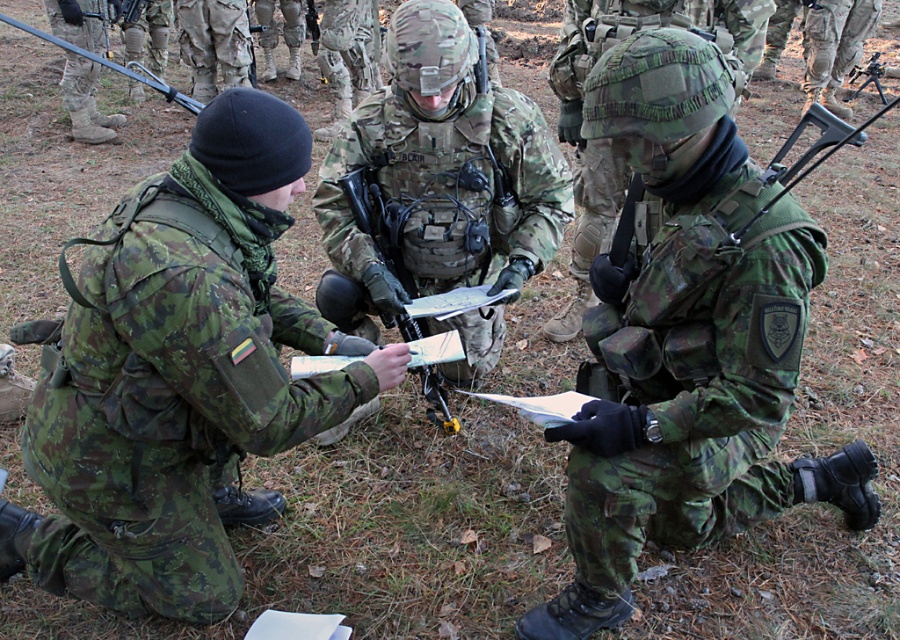
Question: In this image, where is camouflage fabric uniform at center located relative to camouflage fabric rifle at center?

Choices:
 (A) below
 (B) above

Answer: (A)

Question: Which object is positioned closest to the camouflage fabric helmet at center?

Choices:
 (A) camouflage fabric uniform at center
 (B) camouflage uniform at left
 (C) camouflage fabric rifle at center

Answer: (C)

Question: Considering the relative positions of camouflage uniform at left and camouflage fabric uniform at center in the image provided, where is camouflage uniform at left located with respect to camouflage fabric uniform at center?

Choices:
 (A) above
 (B) below

Answer: (B)

Question: Considering the real-world distances, which object is farthest from the camouflage fabric uniform at center?

Choices:
 (A) camouflage fabric rifle at center
 (B) camouflage fabric helmet at center

Answer: (B)

Question: Which of the following is the farthest from the observer?

Choices:
 (A) (454, 419)
 (B) (114, 282)
 (C) (644, 4)
 (D) (724, 248)

Answer: (C)

Question: Is camouflage uniform at left further to the viewer compared to camouflage fabric rifle at center?

Choices:
 (A) no
 (B) yes

Answer: (A)